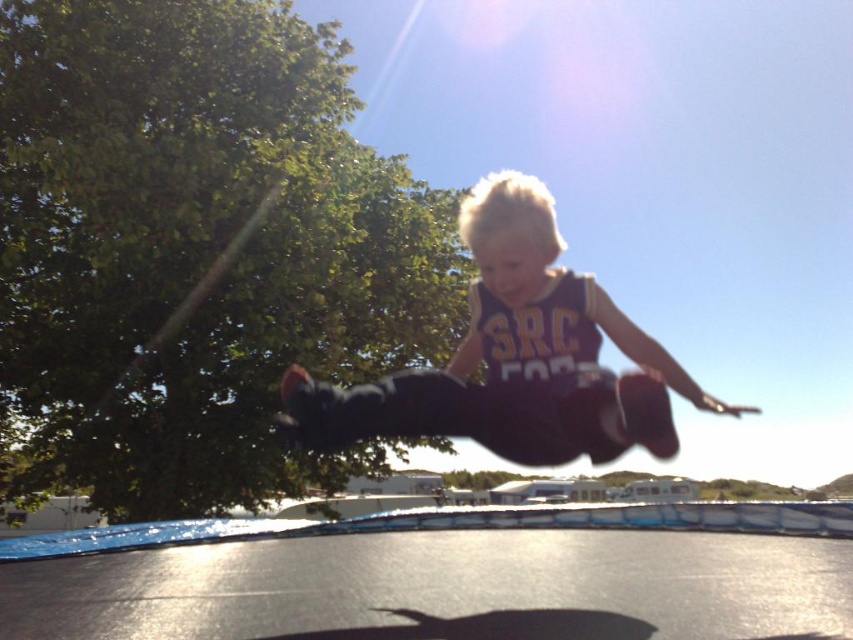
You are a photographer trying to capture the child jumping on the trampoline. You notice the black rubber trampoline at center and the purple jersey at center in your viewfinder. Which object should you focus on to ensure the child is centered in your shot?

The black rubber trampoline at center is positioned on the right side of purple jersey at center. To center the child, focus on the purple jersey at center since it is closer to the child.

You are a photographer trying to capture the child in midair. The black rubber trampoline at center and the purple jersey at center are both in your viewfinder. Based on their heights, which object should you focus on first to ensure the child is in focus?

The purple jersey at center is taller than the black rubber trampoline at center, so you should focus on the purple jersey at center first to ensure the child is in focus.